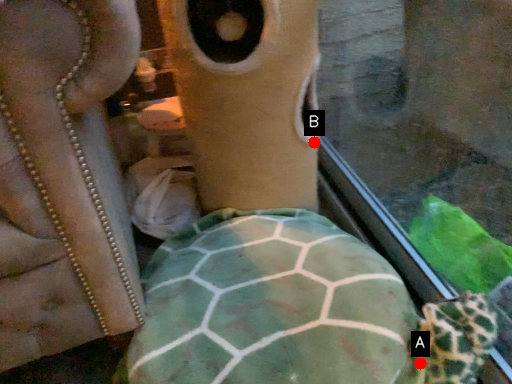
Question: Two points are circled on the image, labeled by A and B beside each circle. Which point is closer to the camera?

Choices:
 (A) A is closer
 (B) B is closer

Answer: (A)